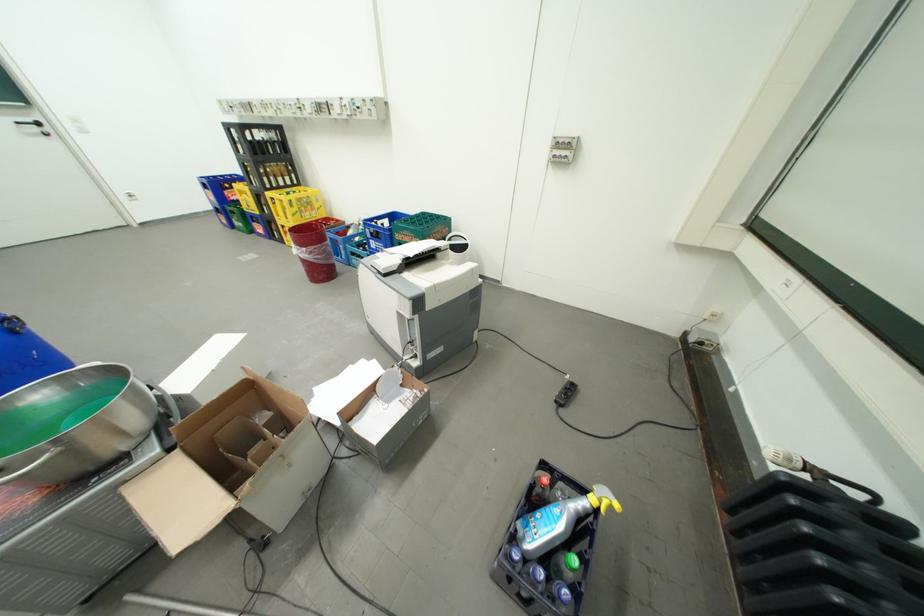
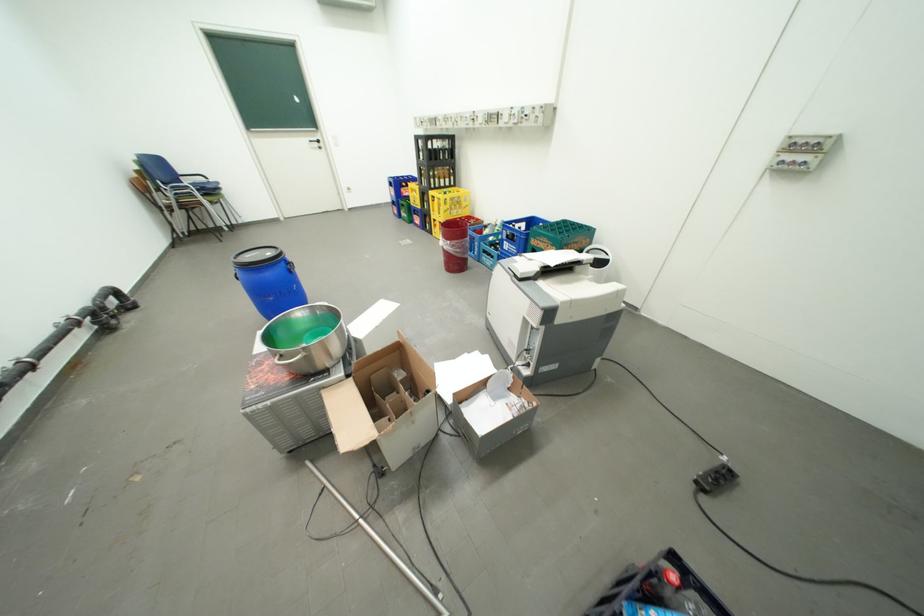
Where in the second image is the point corresponding to point 360,368 from the first image?

(477, 355)